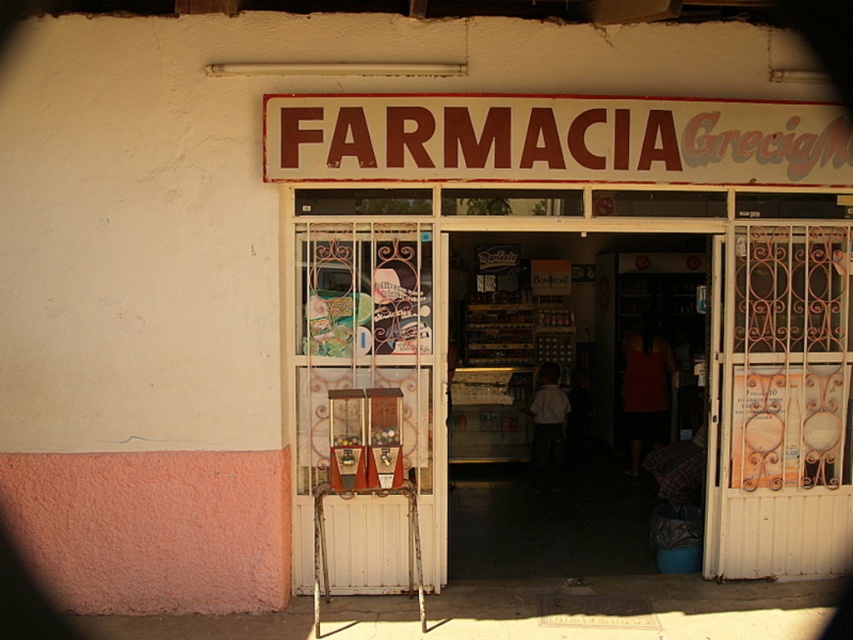
Between brown painted signboard at center and white wooden door at center, which one is positioned lower?

white wooden door at center is lower down.

Is point (650, 106) closer to viewer compared to point (412, 250)?

Yes.

In order to click on brown painted signboard at center in this screenshot , I will do `click(554, 140)`.

Is white painted metal gate at right positioned in front of brown painted signboard at center?

That is False.

Does point (799, 314) come behind point (352, 104)?

Yes, it is behind point (352, 104).

The image size is (853, 640). In order to click on white painted metal gate at right in this screenshot , I will do `click(779, 401)`.

Is white plastic vending machine at center behind white wooden door at center?

Yes, white plastic vending machine at center is behind white wooden door at center.

Can you confirm if white plastic vending machine at center is positioned above white wooden door at center?

Yes, white plastic vending machine at center is above white wooden door at center.

What do you see at coordinates (593, 342) in the screenshot? This screenshot has width=853, height=640. I see `white plastic vending machine at center` at bounding box center [593, 342].

This screenshot has height=640, width=853. In order to click on white plastic vending machine at center in this screenshot , I will do `click(593, 342)`.